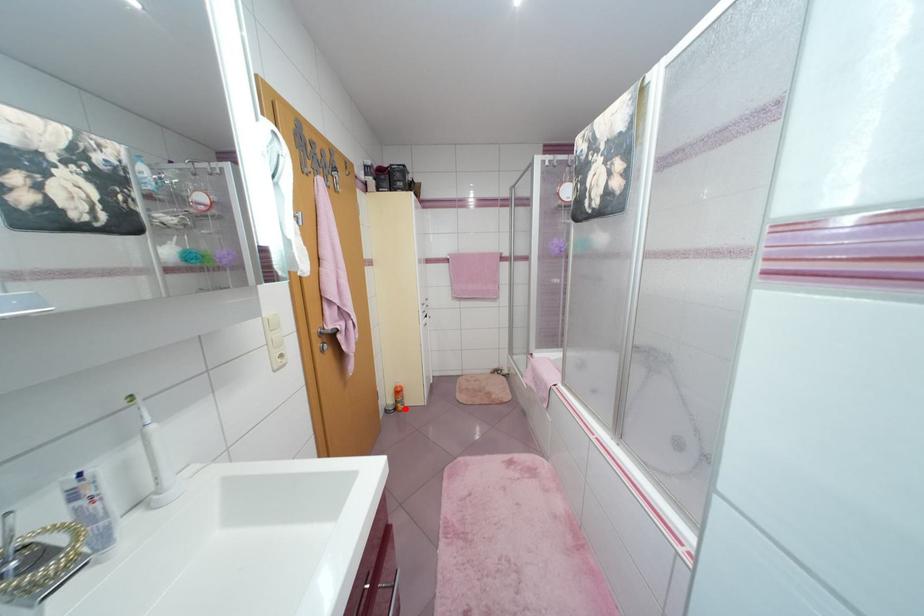
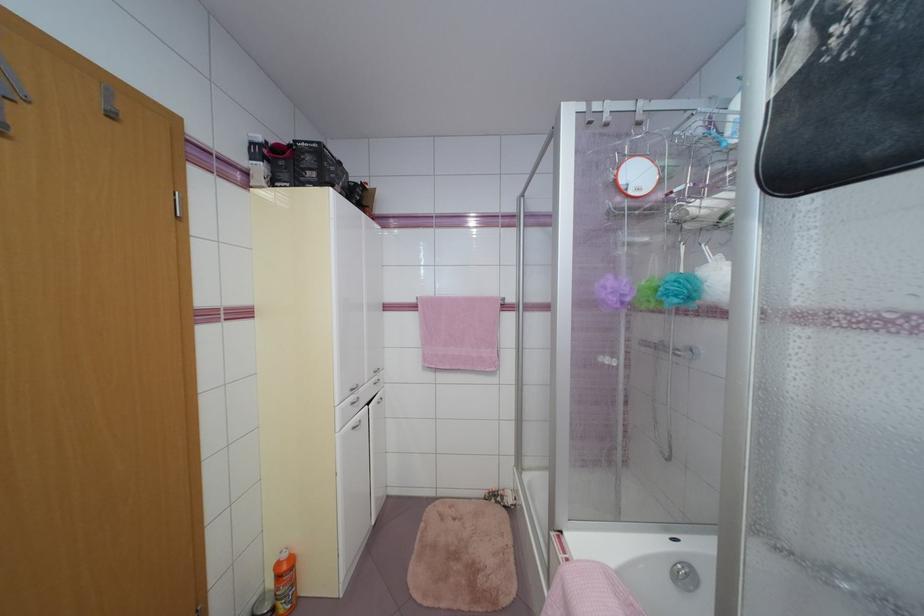
Question: I am providing you with two images of the same scene from different viewpoints. Image1 has a red point marked. In image2, the corresponding 3D location appears at what relative position? Reply with the corresponding letter.

Choices:
 (A) Closer
 (B) Farther

Answer: (A)